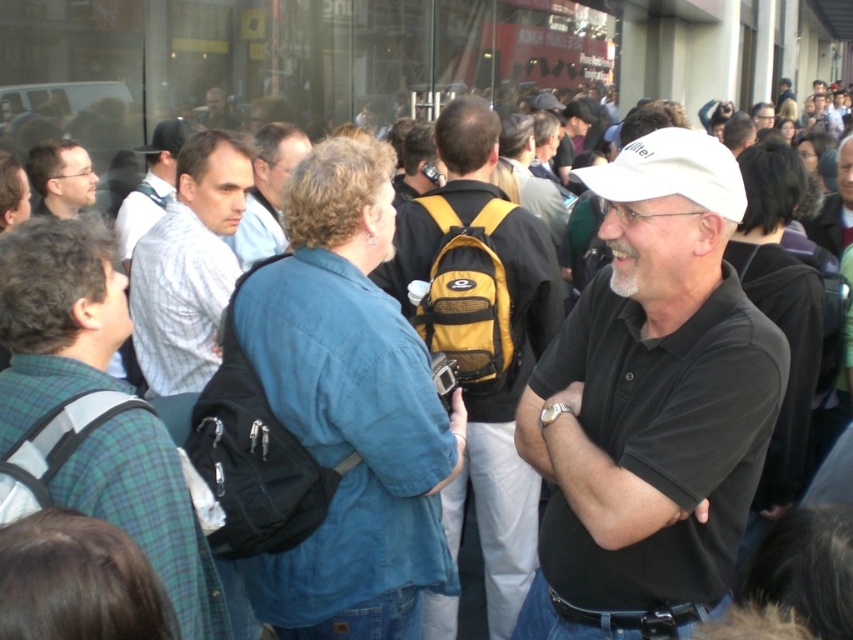
Question: Does white matte cap at center have a larger size compared to matte black glasses at upper left?

Choices:
 (A) no
 (B) yes

Answer: (B)

Question: Which point is farther to the camera?

Choices:
 (A) (750, 486)
 (B) (221, 100)
 (C) (274, 240)

Answer: (B)

Question: Does yellow backpack at center lie in front of matte black backpack at center?

Choices:
 (A) no
 (B) yes

Answer: (B)

Question: Does white matte cap at center have a larger size compared to light blue shirt at center?

Choices:
 (A) no
 (B) yes

Answer: (B)

Question: Which is farther from the matte black backpack at center?

Choices:
 (A) plaid fabric shirt at left
 (B) white striped shirt at center
 (C) light blue shirt at center

Answer: (A)

Question: Which of the following is the closest to the observer?

Choices:
 (A) (535, 444)
 (B) (218, 99)

Answer: (A)